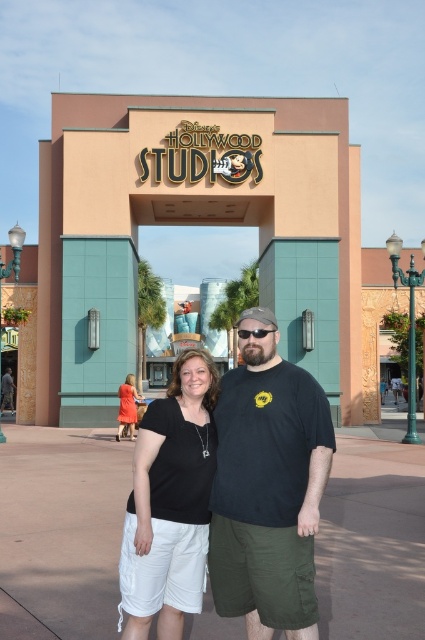
You are taking a photo of the Disney entrance and notice two points marked in the image. Which point, point (235,445) or point (118,428), is closer to your camera lens?

Point (235,445) is closer to the camera than point (118,428).